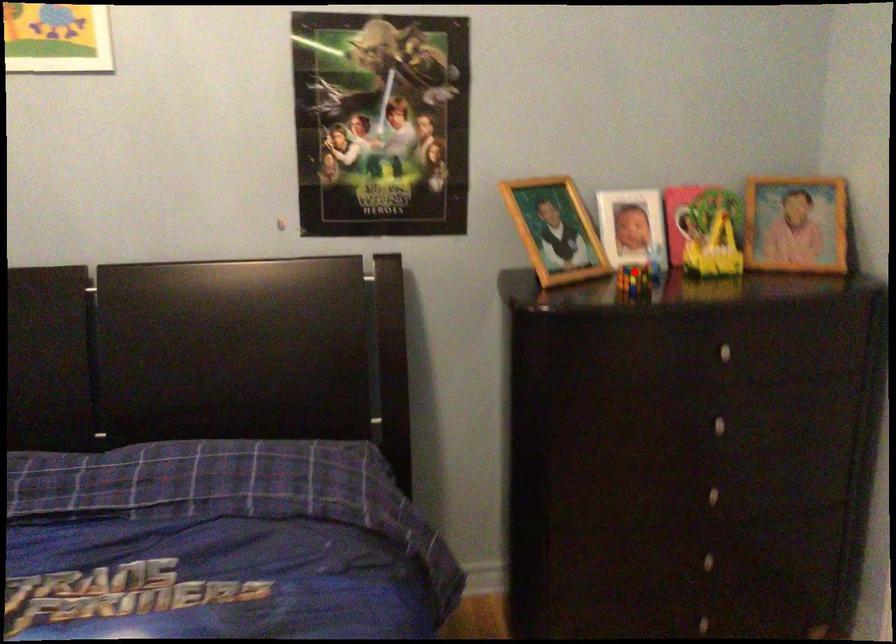
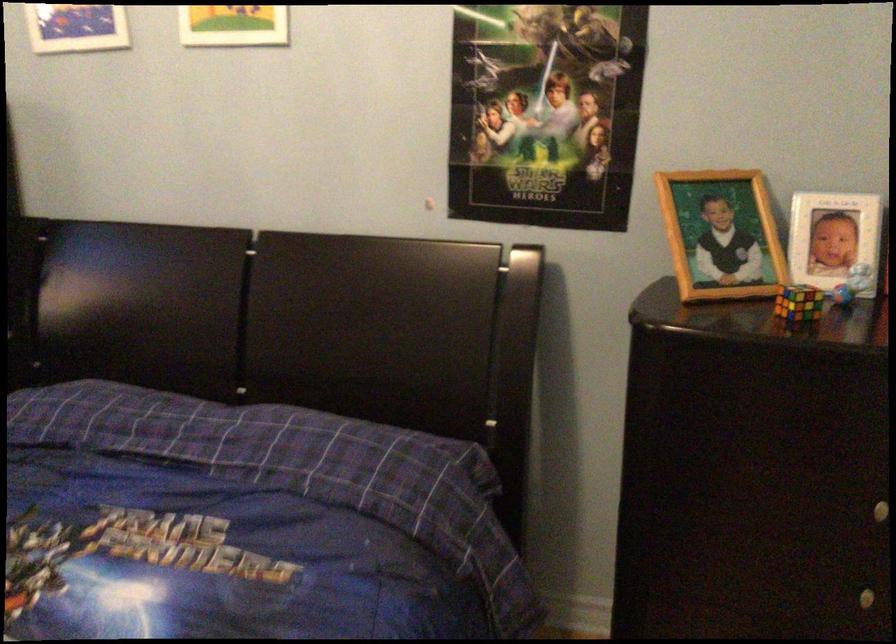
Question: A red point is marked in image1. In image2, is the corresponding 3D point closer to the camera or farther? Reply with the corresponding letter.

Choices:
 (A) The corresponding 3D point is closer.
 (B) The corresponding 3D point is farther.

Answer: (A)